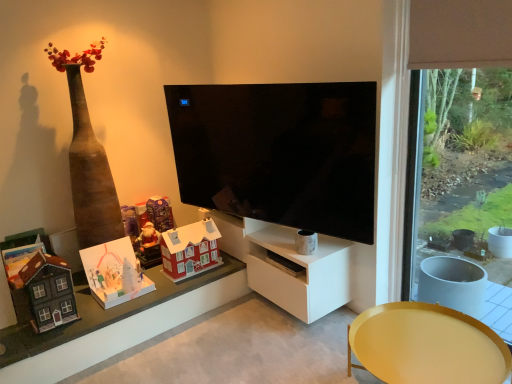
Where is `free location in front of white paper pop-up at lower left, which is the 4th toy in back-to-front order`? free location in front of white paper pop-up at lower left, which is the 4th toy in back-to-front order is located at coordinates (106, 309).